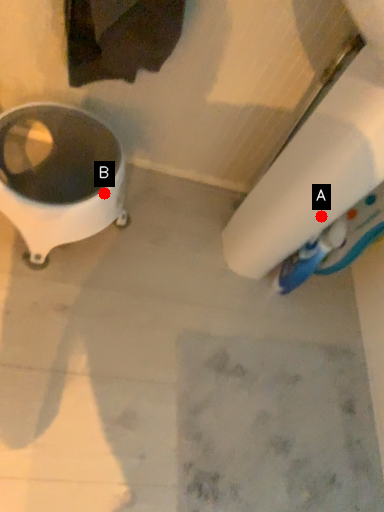
Question: Two points are circled on the image, labeled by A and B beside each circle. Which point is closer to the camera?

Choices:
 (A) A is closer
 (B) B is closer

Answer: (B)